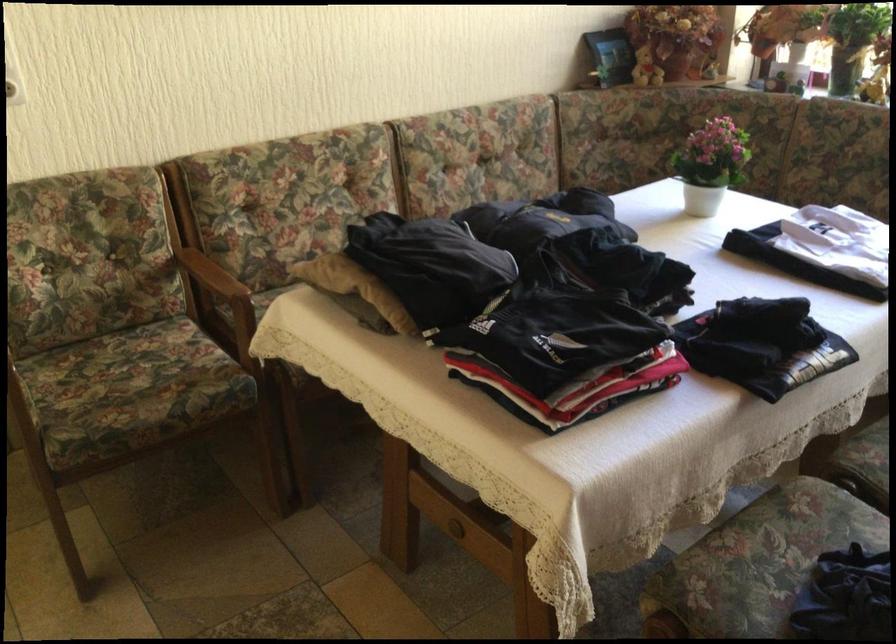
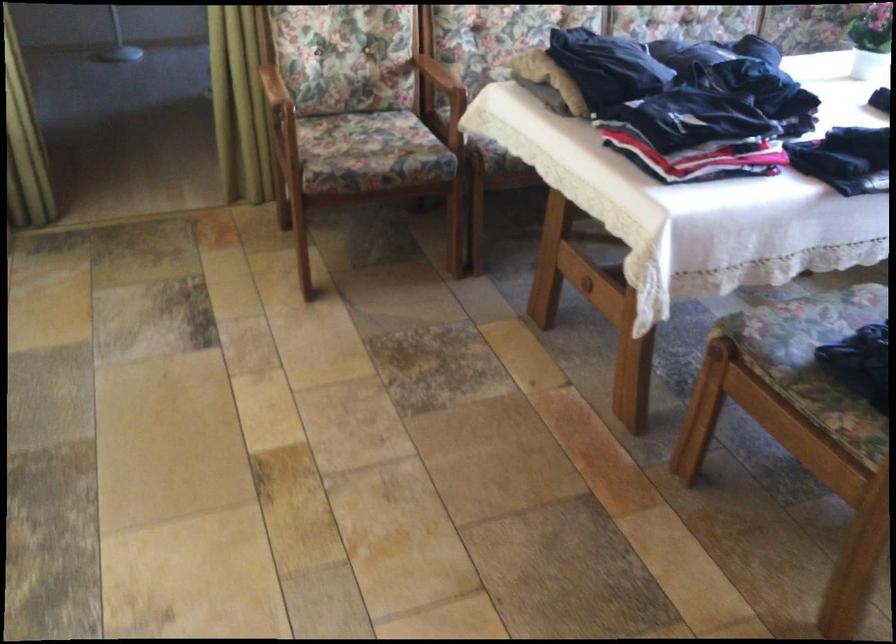
Question: What movement of the cameraman would produce the second image?

Choices:
 (A) Left
 (B) Right
 (C) Forward
 (D) Backward

Answer: (D)